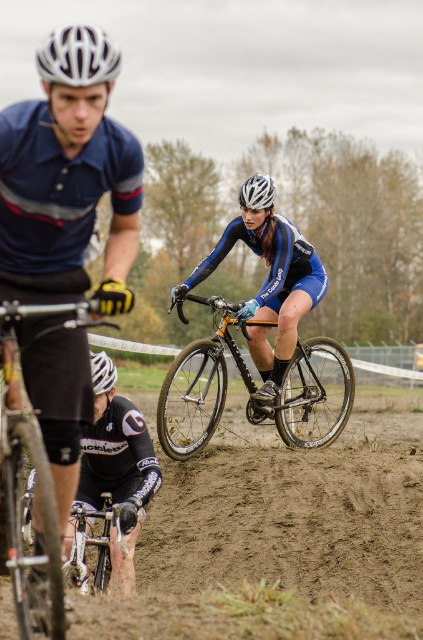
Question: Can you confirm if shiny black bike at center is positioned to the left of matte black helmet at center?

Choices:
 (A) yes
 (B) no

Answer: (B)

Question: Is shiny metallic bicycle at lower left closer to camera compared to white matte bicycle helmet at upper left?

Choices:
 (A) no
 (B) yes

Answer: (B)

Question: Among these objects, which one is nearest to the camera?

Choices:
 (A) shiny black bike at center
 (B) white matte bicycle helmet at center
 (C) matte black helmet at center
 (D) white matte bicycle helmet at upper left

Answer: (D)

Question: Which point is farther from the camera taking this photo?

Choices:
 (A) click(112, 384)
 (B) click(87, 60)
 (C) click(164, 380)

Answer: (C)

Question: Is shiny black bike at center above matte black helmet at center?

Choices:
 (A) yes
 (B) no

Answer: (B)

Question: Which point is closer to the camera?

Choices:
 (A) shiny black bike at center
 (B) shiny metallic bicycle at lower left
 (C) matte black helmet at center

Answer: (B)